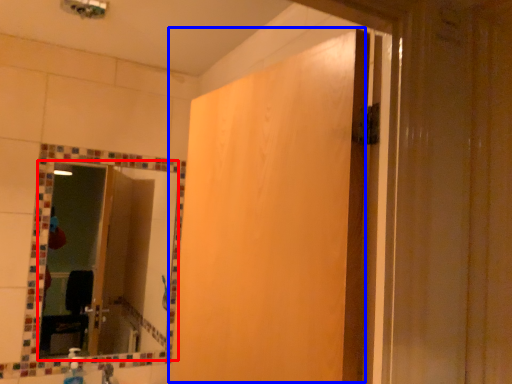
Question: Which object appears farthest to the camera in this image, mirror (highlighted by a red box) or screen door (highlighted by a blue box)?

Choices:
 (A) mirror
 (B) screen door

Answer: (A)